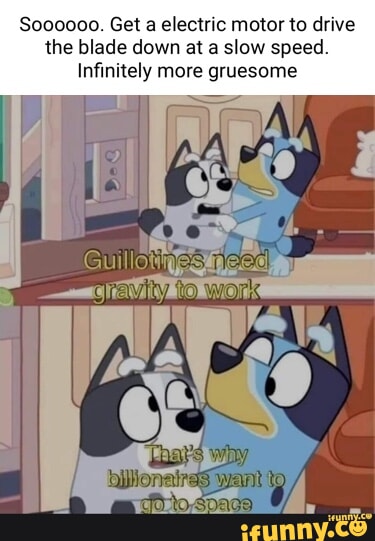
I want to click on chair, so click(x=339, y=213), click(x=339, y=487).